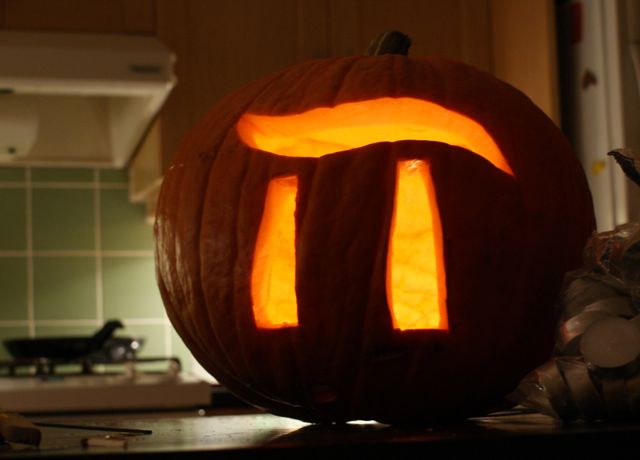
Find the location of `cabinet door`. cabinet door is located at coordinates (237, 23), (454, 25).